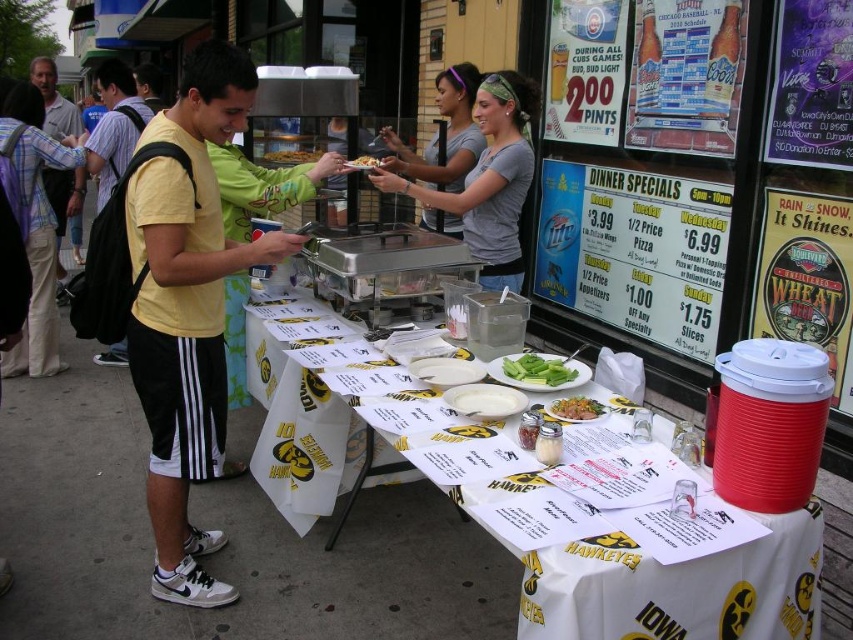
Does yellow t-shirt at center have a greater width compared to golden crispy fries at center?

Yes, yellow t-shirt at center is wider than golden crispy fries at center.

This screenshot has height=640, width=853. What do you see at coordinates (189, 308) in the screenshot?
I see `yellow t-shirt at center` at bounding box center [189, 308].

Between point (209, 534) and point (352, 163), which one is positioned in front?

Positioned in front is point (209, 534).

The width and height of the screenshot is (853, 640). In order to click on yellow t-shirt at center in this screenshot , I will do `click(189, 308)`.

This screenshot has height=640, width=853. Describe the element at coordinates (538, 369) in the screenshot. I see `green matte cucumber at center` at that location.

Is point (566, 378) farther from camera compared to point (578, 401)?

Yes, it is behind point (578, 401).

At what (x,y) coordinates should I click in order to perform the action: click on green matte cucumber at center. Please return your answer as a coordinate pair (x, y). Looking at the image, I should click on (538, 369).

Does light gray shirt at upper left have a greater width compared to golden crispy chicken at center?

Correct, the width of light gray shirt at upper left exceeds that of golden crispy chicken at center.

Does light gray shirt at upper left have a larger size compared to golden crispy chicken at center?

Yes, light gray shirt at upper left is bigger than golden crispy chicken at center.

Which is in front, point (68, 202) or point (572, 412)?

Point (572, 412) is more forward.

Find the location of a particular element. light gray shirt at upper left is located at coordinates (54, 100).